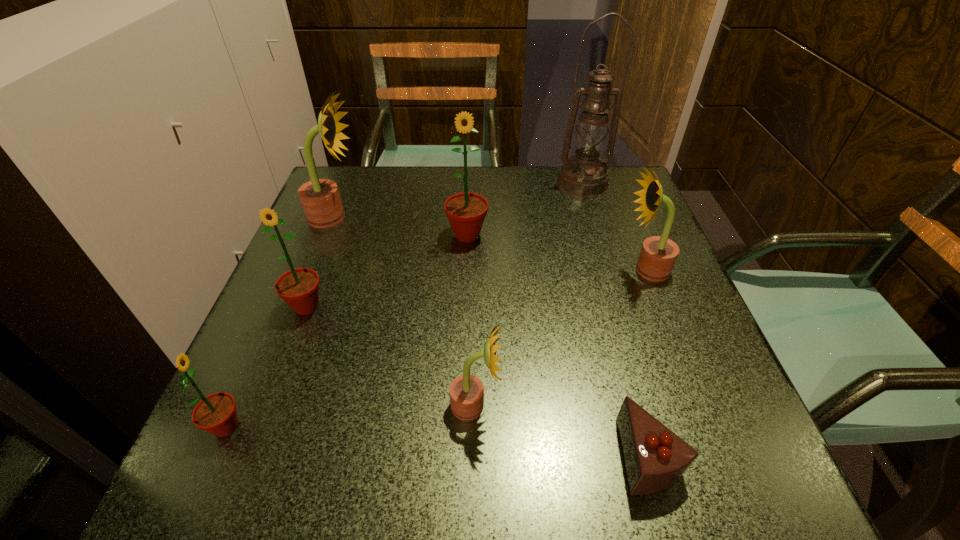
Where is `free space at the far right corner of the desktop`? This screenshot has height=540, width=960. free space at the far right corner of the desktop is located at coordinates (612, 200).

In the image, there is a desktop. Where is `blank space at the near right corner`? The height and width of the screenshot is (540, 960). blank space at the near right corner is located at coordinates (756, 500).

The image size is (960, 540). Find the location of `unoccupied position between the oil lamp and the shortest object`. unoccupied position between the oil lamp and the shortest object is located at coordinates (615, 319).

Locate an element on the screen. The image size is (960, 540). empty space between the farthest yellow sunflower and the nearest yellow sunflower is located at coordinates (404, 312).

I want to click on vacant space in between the shortest object and the biggest green sunflower, so click(x=558, y=345).

This screenshot has height=540, width=960. In order to click on empty space between the farthest object and the rightmost sunflower in this screenshot , I will do `click(613, 227)`.

Where is `vacant space that is in between the chocolate cake and the second nearest yellow sunflower`? vacant space that is in between the chocolate cake and the second nearest yellow sunflower is located at coordinates (647, 362).

Locate an element on the screen. The image size is (960, 540). empty space between the smallest yellow sunflower and the shortest object is located at coordinates (562, 430).

You are a GUI agent. You are given a task and a screenshot of the screen. Output one action in this format:
    pyautogui.click(x=<x>, y=<y>)
    Task: Click on the free space that is in between the fifth nearest object and the shortest object
    This screenshot has height=540, width=960.
    Given the screenshot: What is the action you would take?
    (x=647, y=362)

The height and width of the screenshot is (540, 960). I want to click on free space between the smallest green sunflower and the fourth nearest sunflower, so click(436, 348).